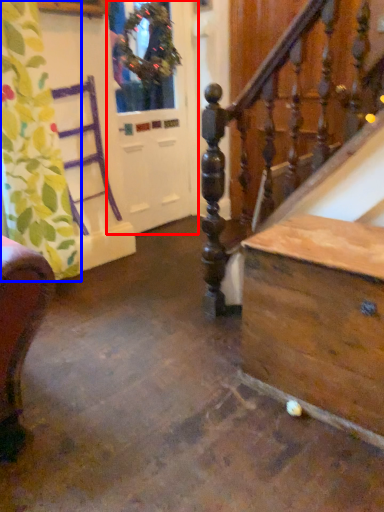
Question: Which point is further to the camera, screen door (highlighted by a red box) or curtain (highlighted by a blue box)?

Choices:
 (A) screen door
 (B) curtain

Answer: (A)